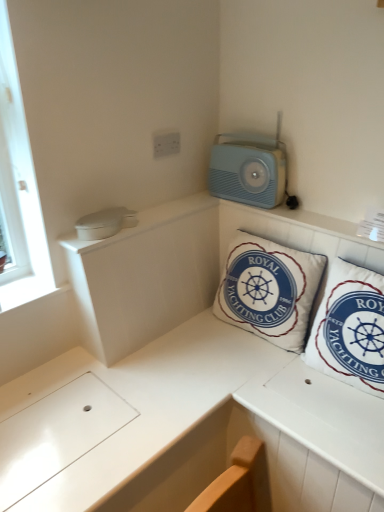
Question: Considering the positions of point (367, 392) and point (256, 158), is point (367, 392) closer or farther from the camera than point (256, 158)?

Choices:
 (A) closer
 (B) farther

Answer: (A)

Question: From the image's perspective, is white fabric pillow at upper right, which is the first pillow from right to left, above or below light blue plastic radio at upper right?

Choices:
 (A) below
 (B) above

Answer: (A)

Question: Which is nearer to the white plastic electric outlet at upper center?

Choices:
 (A) white fabric pillow at upper right, positioned as the second pillow in left-to-right order
 (B) light blue plastic radio at upper right
 (C) white cotton cushion at center, which is the 2th pillow from right to left

Answer: (B)

Question: Which object is the closest to the light blue plastic radio at upper right?

Choices:
 (A) white cotton cushion at center, the first pillow from the left
 (B) white plastic electric outlet at upper center
 (C) white fabric pillow at upper right, which is the first pillow from right to left

Answer: (B)